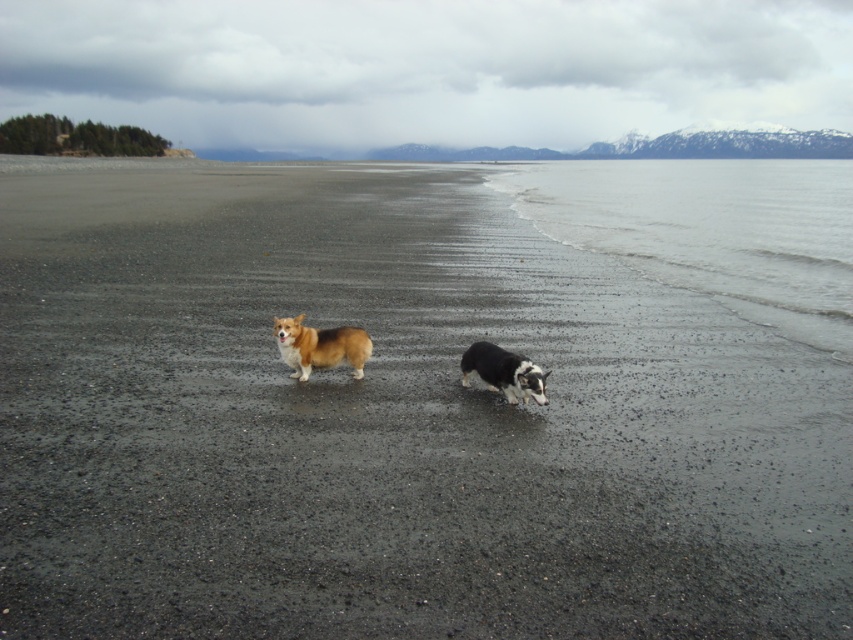
You are a photographer trying to capture the perfect shot of the brown plush corgi at center. Based on the scene, where should you position your camera to ensure the corgi is centered in your photo?

To center the brown plush corgi at center in your photo, position your camera directly facing the corgi at coordinates approximately 0.542 on the x and 0.375 on the y axis, as this is where the corgi is located in the scene.

You are standing on the beach and want to take a photo of the black and white fur dog at center without the clear water at lower right appearing in the background. Is this possible based on their positions?

The clear water at lower right is positioned over the black and white fur dog at center, so taking a photo of the black and white fur dog at center without the clear water at lower right in the background is not possible due to their overlapping positions.

You are a photographer trying to capture both the brown plush corgi at center and the black and white fur dog at center in the same frame. Which dog should you adjust your camera to focus on first if you want to include both in your shot?

The brown plush corgi at center is positioned on the left side of black and white fur dog at center, so you should focus on the brown plush corgi at center first to ensure both are in frame.